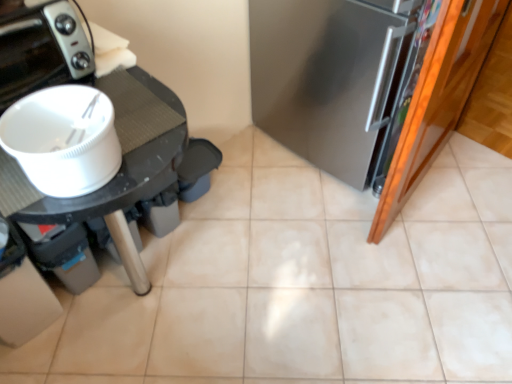
Where is `satin silver refrigerator at right`? satin silver refrigerator at right is located at coordinates click(x=338, y=79).

This screenshot has height=384, width=512. What do you see at coordinates (338, 79) in the screenshot?
I see `satin silver refrigerator at right` at bounding box center [338, 79].

This screenshot has height=384, width=512. Find the location of `beige ceramic tile at center`. beige ceramic tile at center is located at coordinates (301, 283).

What is the approximate height of beige ceramic tile at center?

The height of beige ceramic tile at center is 1.93 inches.

This screenshot has width=512, height=384. Identify the location of white plastic table at left. (122, 152).

Considering the relative sizes of beige ceramic tile at center and satin silver refrigerator at right in the image provided, is beige ceramic tile at center wider than satin silver refrigerator at right?

Correct, the width of beige ceramic tile at center exceeds that of satin silver refrigerator at right.

Which is closer, (446,200) or (422,0)?

The point (422,0) is in front.

Does beige ceramic tile at center appear on the right side of satin silver refrigerator at right?

In fact, beige ceramic tile at center is to the left of satin silver refrigerator at right.

Is beige ceramic tile at center inside or outside of satin silver refrigerator at right?

beige ceramic tile at center is outside satin silver refrigerator at right.

From the image's perspective, between black glossy toaster at upper left and white matte bowl at left, which one is located above?

From the image's view, black glossy toaster at upper left is above.

Is black glossy toaster at upper left in front of or behind white matte bowl at left in the image?

In the image, black glossy toaster at upper left appears behind white matte bowl at left.

Considering the positions of points (55, 19) and (100, 110), is point (55, 19) closer to camera compared to point (100, 110)?

No, it is behind (100, 110).

Can we say black glossy toaster at upper left lies outside white matte bowl at left?

black glossy toaster at upper left lies outside white matte bowl at left's area.

At what (x,y) coordinates should I click in order to perform the action: click on fridge located behind the white matte bowl at left. Please return your answer as a coordinate pair (x, y). This screenshot has height=384, width=512. Looking at the image, I should click on (338, 79).

Who is shorter, satin silver refrigerator at right or white matte bowl at left?

Standing shorter between the two is white matte bowl at left.

From the image's perspective, is satin silver refrigerator at right above white matte bowl at left?

Correct, satin silver refrigerator at right appears higher than white matte bowl at left in the image.

Is there a large distance between satin silver refrigerator at right and white matte bowl at left?

Yes, satin silver refrigerator at right and white matte bowl at left are quite far apart.

In the scene shown: How far apart are beige ceramic tile at center and white plastic table at left?

beige ceramic tile at center and white plastic table at left are 33.73 inches apart from each other.

Does beige ceramic tile at center turn towards white plastic table at left?

No, beige ceramic tile at center is not aimed at white plastic table at left.

Is beige ceramic tile at center bigger than white plastic table at left?

Yes.

Between beige ceramic tile at center and white plastic table at left, which one has less height?

white plastic table at left is shorter.

Is satin silver refrigerator at right facing towards beige ceramic tile at center?

Yes.

Does satin silver refrigerator at right appear on the right side of beige ceramic tile at center?

Correct, you'll find satin silver refrigerator at right to the right of beige ceramic tile at center.

Considering the sizes of objects satin silver refrigerator at right and beige ceramic tile at center in the image provided, who is shorter, satin silver refrigerator at right or beige ceramic tile at center?

Standing shorter between the two is beige ceramic tile at center.

Which point is more forward, [322,82] or [83,198]?

The point [83,198] is more forward.

Which object is positioned more to the right, satin silver refrigerator at right or white plastic table at left?

satin silver refrigerator at right.

What's the angular difference between satin silver refrigerator at right and white plastic table at left's facing directions?

The facing directions of satin silver refrigerator at right and white plastic table at left are 93.2 degrees apart.

Is white matte bowl at left with black glossy toaster at upper left?

No, white matte bowl at left is not making contact with black glossy toaster at upper left.

Is point (67, 180) closer or farther from the camera than point (89, 54)?

Point (67, 180) is closer to the camera than point (89, 54).

From the image's perspective, relative to black glossy toaster at upper left, is white matte bowl at left above or below?

From the image's perspective, white matte bowl at left appears below black glossy toaster at upper left.

Is white matte bowl at left oriented away from black glossy toaster at upper left?

Yes, white matte bowl at left is positioned with its back facing black glossy toaster at upper left.

Find the location of a particular element. The image size is (512, 384). fridge on the right of the beige ceramic tile at center is located at coordinates (338, 79).

Find the location of `kitchen appliance located in front of the black glossy toaster at upper left`. kitchen appliance located in front of the black glossy toaster at upper left is located at coordinates pyautogui.click(x=63, y=139).

Estimate the real-world distances between objects in this image. Which object is further from white plastic table at left, black glossy toaster at upper left or satin silver refrigerator at right?

satin silver refrigerator at right is positioned further to the anchor white plastic table at left.

Based on their spatial positions, is satin silver refrigerator at right or white matte bowl at left further from black glossy toaster at upper left?

Among the two, satin silver refrigerator at right is located further to black glossy toaster at upper left.

From the image, which object appears to be nearer to beige ceramic tile at center, black glossy toaster at upper left or white plastic table at left?

white plastic table at left is positioned closer to the anchor beige ceramic tile at center.

From the image, which object appears to be farther from white matte bowl at left, satin silver refrigerator at right or white plastic table at left?

Among the two, satin silver refrigerator at right is located further to white matte bowl at left.

Considering their positions, is beige ceramic tile at center positioned further to satin silver refrigerator at right than black glossy toaster at upper left?

Based on the image, black glossy toaster at upper left appears to be further to satin silver refrigerator at right.

From the image, which object appears to be farther from beige ceramic tile at center, black glossy toaster at upper left or satin silver refrigerator at right?

Among the two, black glossy toaster at upper left is located further to beige ceramic tile at center.

Which object lies further to the anchor point satin silver refrigerator at right, white plastic table at left or beige ceramic tile at center?

Based on the image, white plastic table at left appears to be further to satin silver refrigerator at right.

Based on their spatial positions, is white plastic table at left or black glossy toaster at upper left further from white matte bowl at left?

The object further to white matte bowl at left is black glossy toaster at upper left.

At what (x,y) coordinates should I click in order to perform the action: click on table located between black glossy toaster at upper left and beige ceramic tile at center in the left-right direction. Please return your answer as a coordinate pair (x, y). The width and height of the screenshot is (512, 384). Looking at the image, I should click on (122, 152).

Where is `table located between black glossy toaster at upper left and satin silver refrigerator at right in the left-right direction`? This screenshot has width=512, height=384. table located between black glossy toaster at upper left and satin silver refrigerator at right in the left-right direction is located at coordinates (122, 152).

Locate an element on the screen. This screenshot has height=384, width=512. kitchen appliance between satin silver refrigerator at right and beige ceramic tile at center from top to bottom is located at coordinates (63, 139).

Locate an element on the screen. The image size is (512, 384). kitchen appliance situated between white plastic table at left and satin silver refrigerator at right from left to right is located at coordinates tap(63, 139).